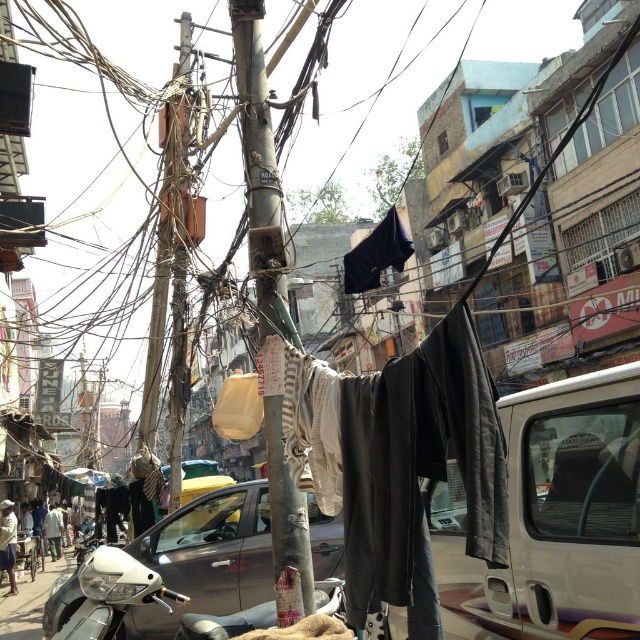
You are a delivery person trying to navigate through the narrow alley between the rusty metal pole at center and the light brown fabric at lower left. Can you pass through without touching either object?

The rusty metal pole at center is thinner than the light brown fabric at lower left. Since the pole is thinner, there might be enough space between them to pass through, but the exact width isn

You are standing on the sidewalk and want to take a photo of the rusty metal pole at center. If your camera can focus on objects up to 15 feet away, will you be able to capture a clear image of the pole?

The distance between the rusty metal pole at center and the viewer is 14.92 feet, which is within the camera focus range of up to 15 feet. Therefore, you can capture a clear image of the pole.

You are a delivery person trying to navigate through the street. There is a rusty metal pole at center. Can you pass through the point at coordinate (259,164)?

The point at coordinate (259,164) indicates the rusty metal pole at center, so you cannot pass through it as it is an obstacle in your path.